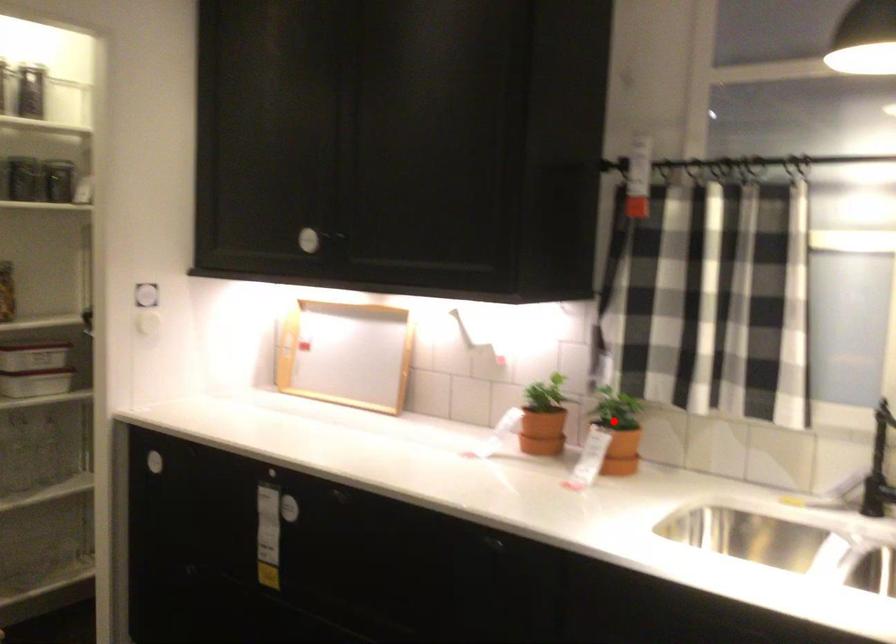
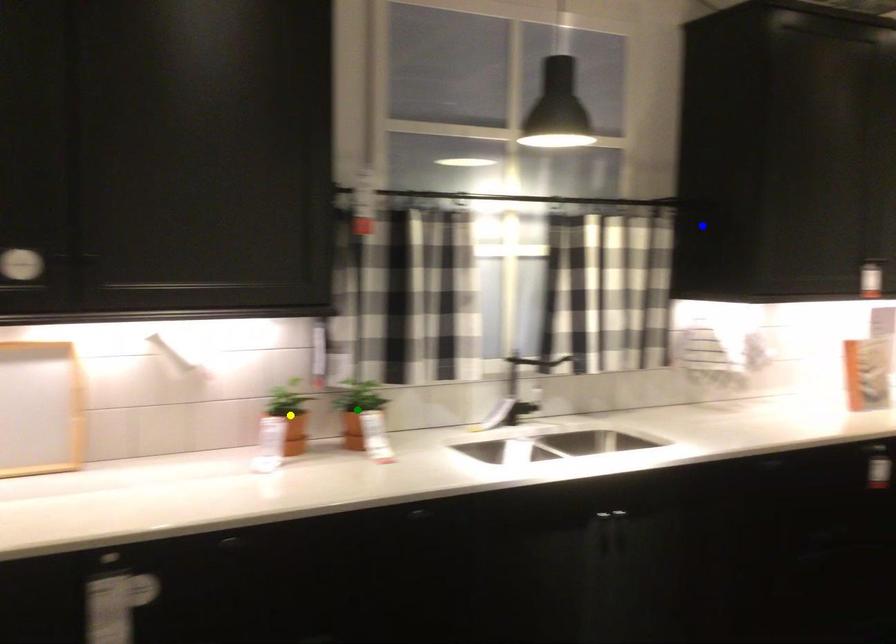
Question: I am providing you with two images of the same scene from different viewpoints. A red point is marked on the first image. You are given multiple points on the second image. Which point in image 2 represents the same 3d spot as the red point in image 1?

Choices:
 (A) green point
 (B) yellow point
 (C) blue point

Answer: (A)